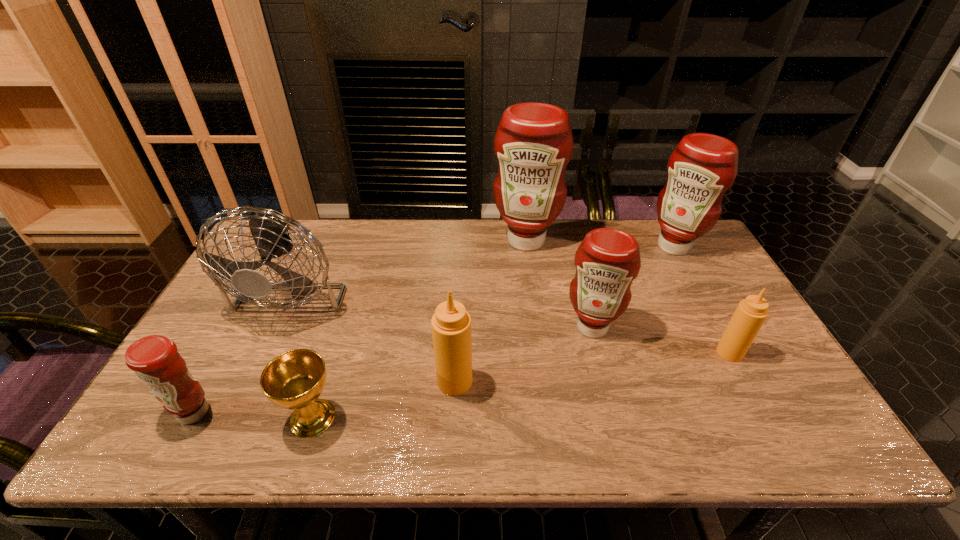
Identify the location of the farther tan condiment. tap(750, 314).

This screenshot has height=540, width=960. I want to click on the smallest red condiment, so click(155, 360).

What are the coordinates of `the leftmost condiment` in the screenshot? It's located at (155, 360).

I want to click on chalice, so click(x=294, y=380).

Where is `gold chalice`? gold chalice is located at coordinates (294, 380).

At what (x,y) coordinates should I click in order to perform the action: click on vacant area located on the left of the tallest object. Please return your answer as a coordinate pair (x, y). Looking at the image, I should click on (461, 240).

Find the location of a particular element. vacant space located 0.180m on the front of the third smallest red condiment is located at coordinates (704, 300).

Image resolution: width=960 pixels, height=540 pixels. I want to click on free space located 0.150m on the front-facing side of the fan, so click(252, 383).

The width and height of the screenshot is (960, 540). What are the coordinates of `vacant space located on the right of the fifth object from right to left` in the screenshot? It's located at (514, 381).

Locate an element on the screen. vacant space located 0.350m on the right of the third farthest red condiment is located at coordinates (746, 327).